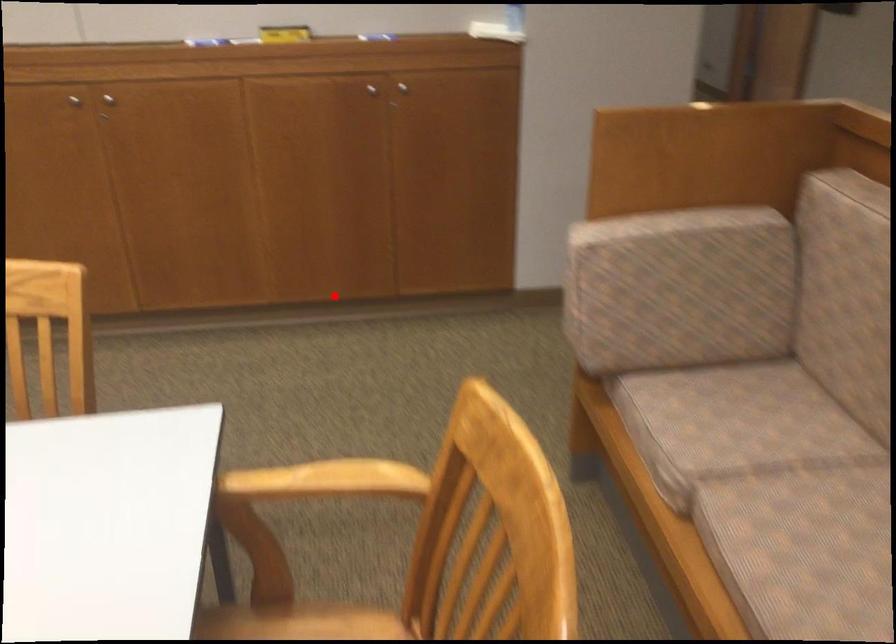
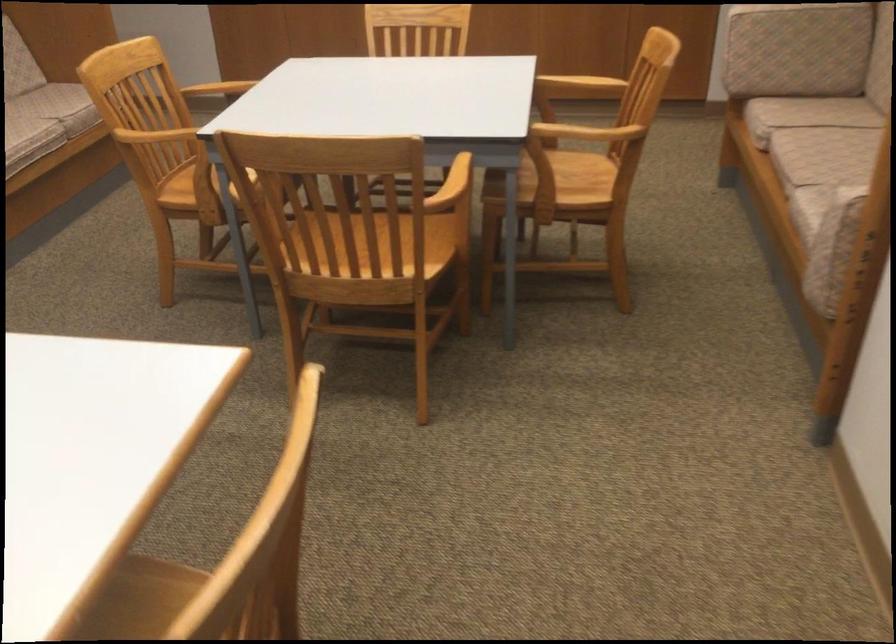
Question: I am providing you with two images of the same scene from different viewpoints. A red point is marked on the first image. Is the red point's position out of view in image 2?

Choices:
 (A) Yes
 (B) No

Answer: (B)